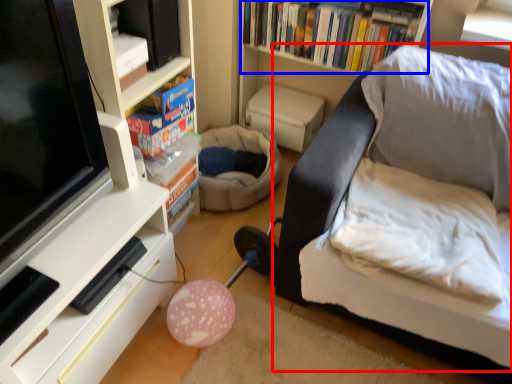
Question: Which point is further to the camera, studio couch (highlighted by a red box) or book (highlighted by a blue box)?

Choices:
 (A) studio couch
 (B) book

Answer: (B)